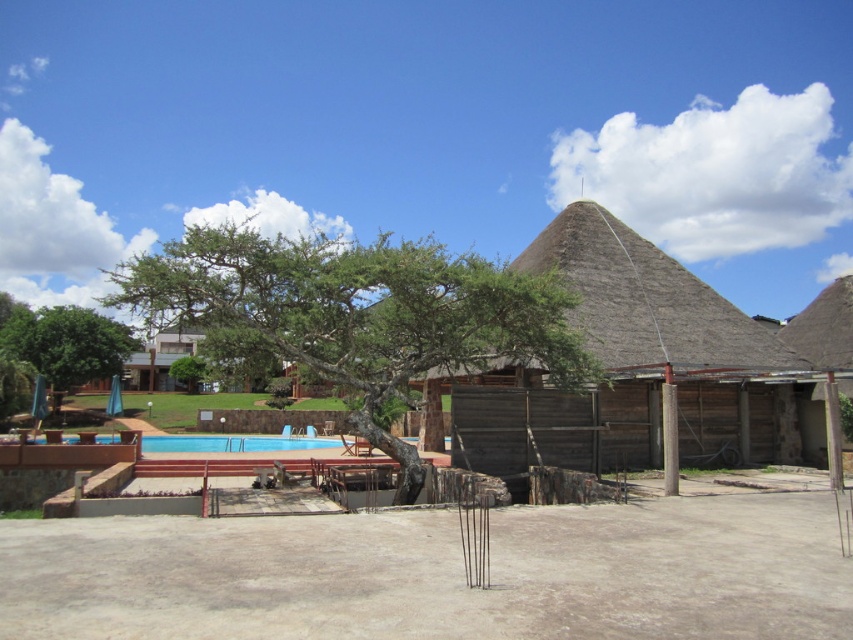
You are standing at the point marked as point (354, 314) in the image. What object are you currently standing on?

You are standing on the green leafy tree at center.

You are planning to set up an umbrella for shade. You have two options in the scene, the thatched wood hut at center and the thatched straw roof at upper right. Which location would provide better shade based on their positions?

The thatched wood hut at center is located below thatched straw roof at upper right, so the thatched straw roof at upper right would provide better shade as it is positioned above the hut.

Looking at this image, you are standing in the resort area and want to take a photo of both the thatched wood hut at center and the thatched straw roof at upper right. Which object should you focus on first to ensure both are in clear view?

You should focus on the thatched wood hut at center first because it is closer to you than the thatched straw roof at upper right, so adjusting focus from near to far will help both objects be in clear view.